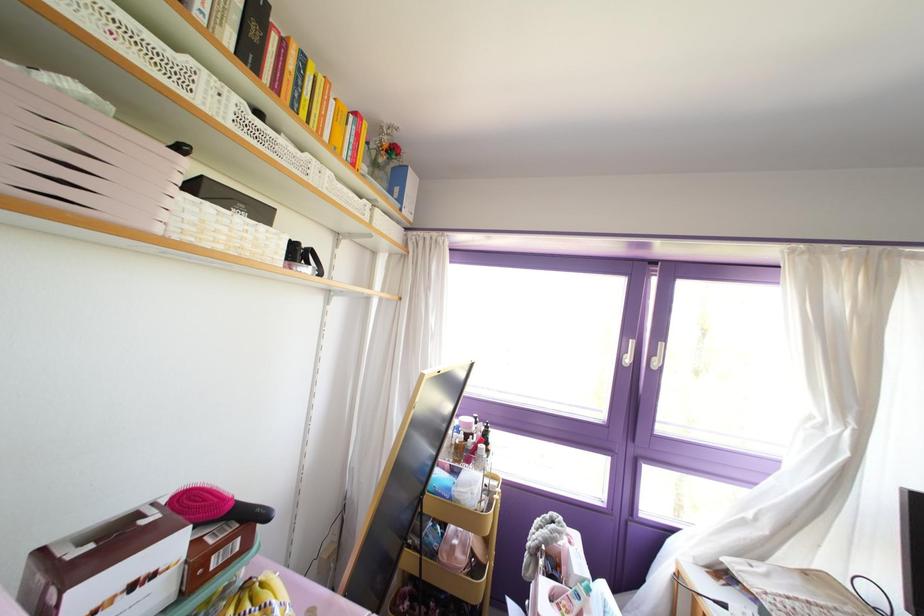
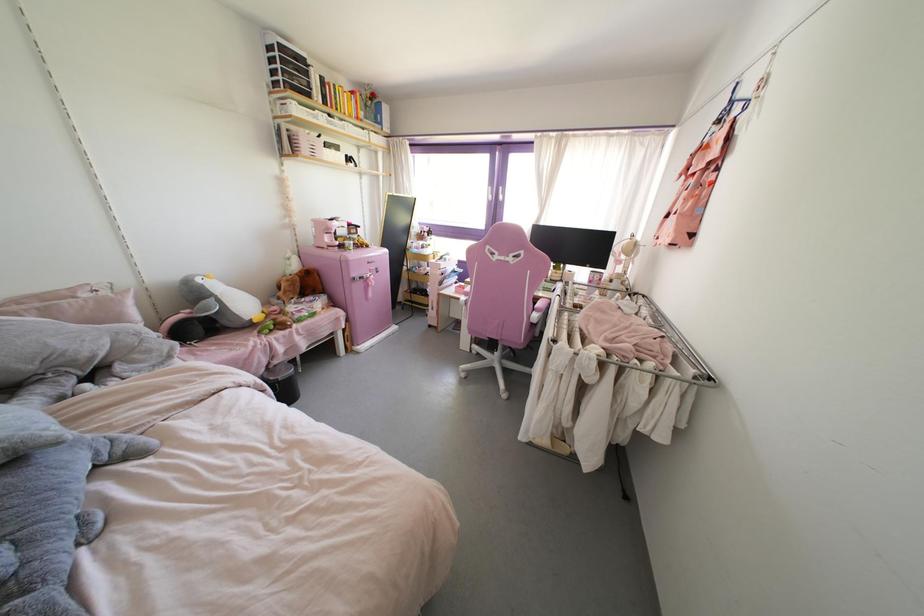
Where in the second image is the point corresponding to the point at 237,219 from the first image?

(333, 151)